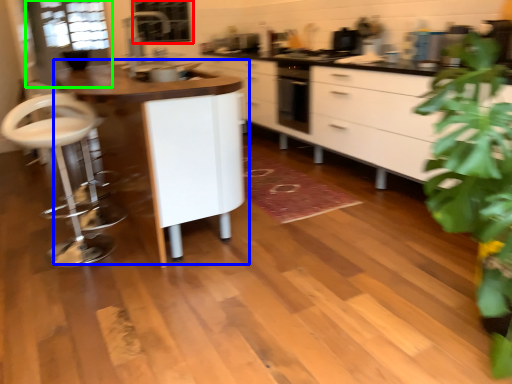
Question: Which object is positioned farthest from window screen (highlighted by a red box)? Select from table (highlighted by a blue box) and glass door (highlighted by a green box).

Choices:
 (A) table
 (B) glass door

Answer: (A)